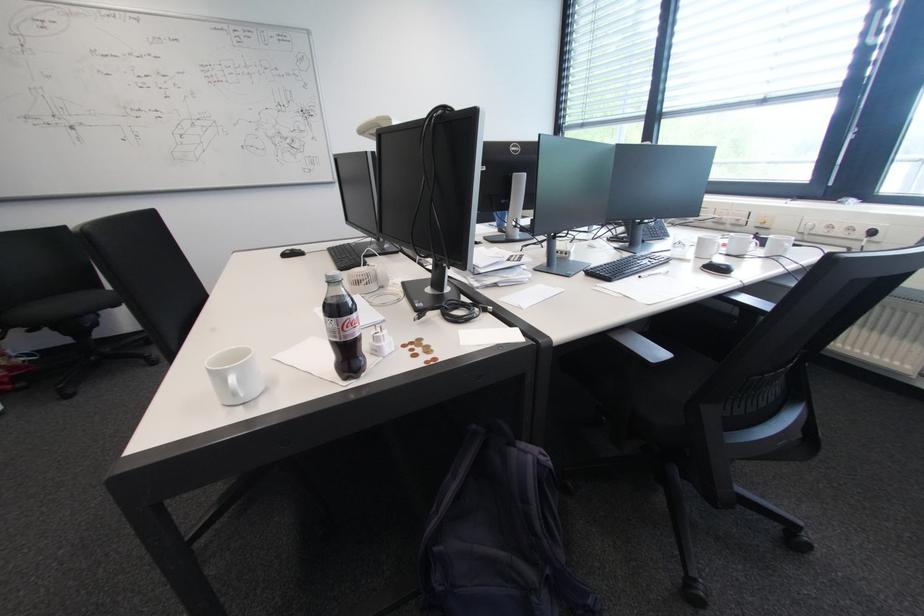
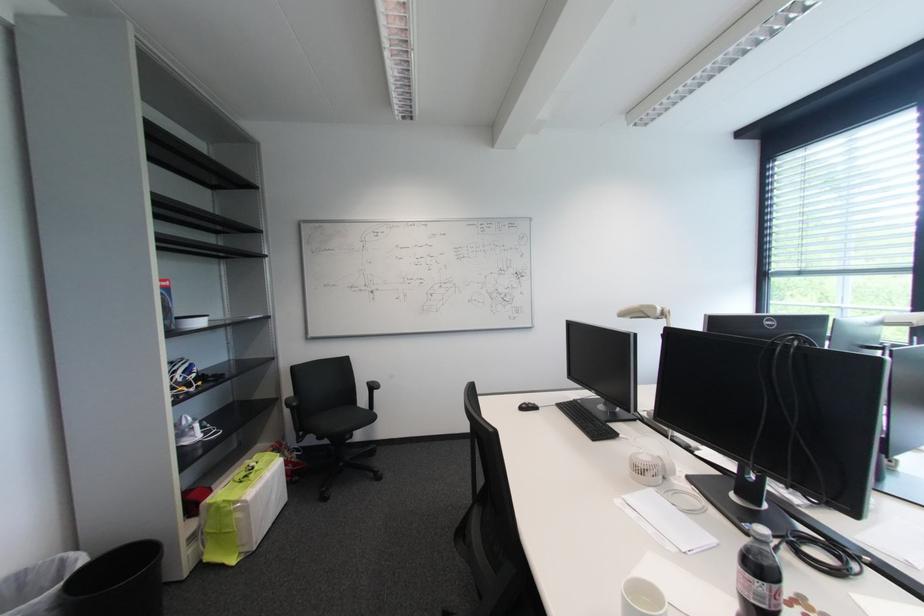
Where in the second image is the point corresponding to (x=334, y=321) from the first image?

(766, 583)